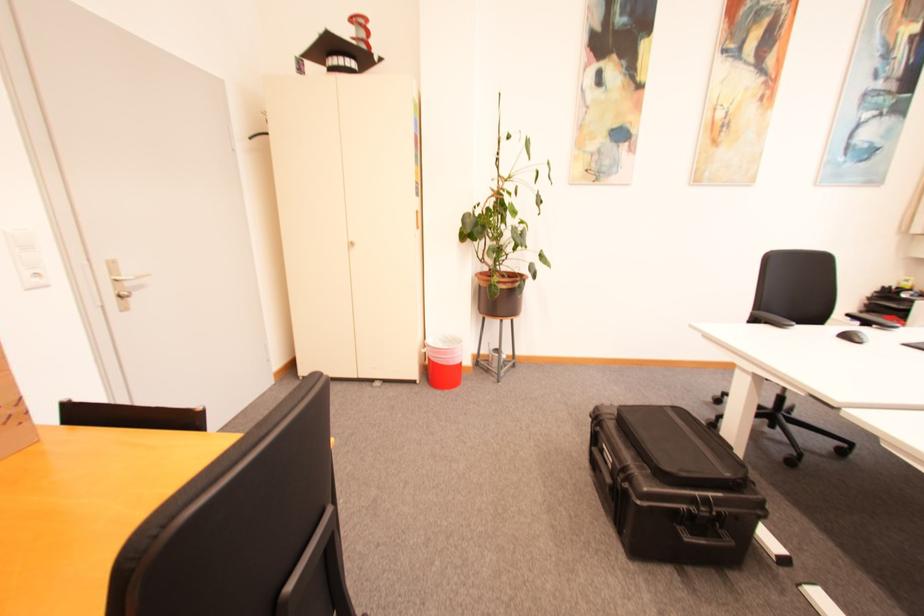
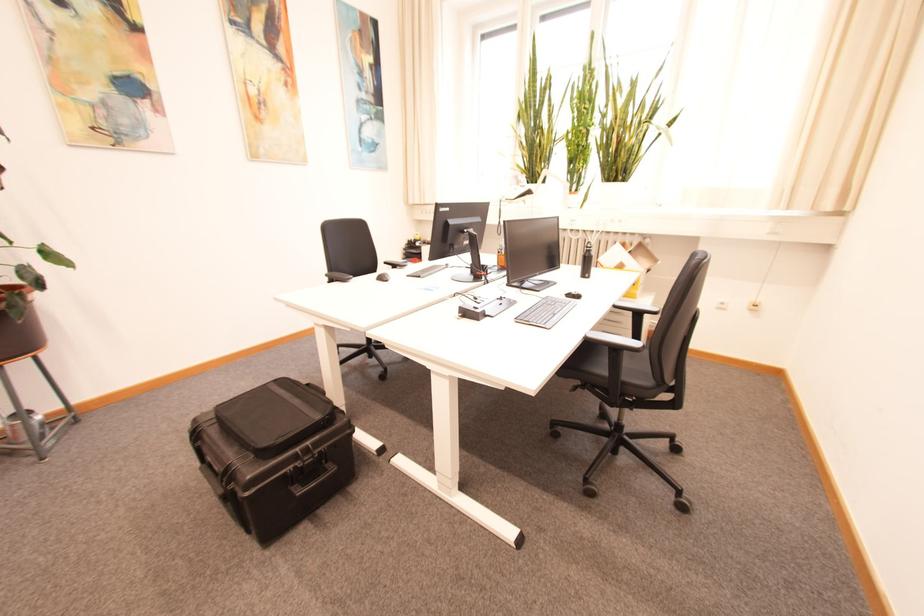
The point at [855,339] is marked in the first image. Where is the corresponding point in the second image?

(388, 280)